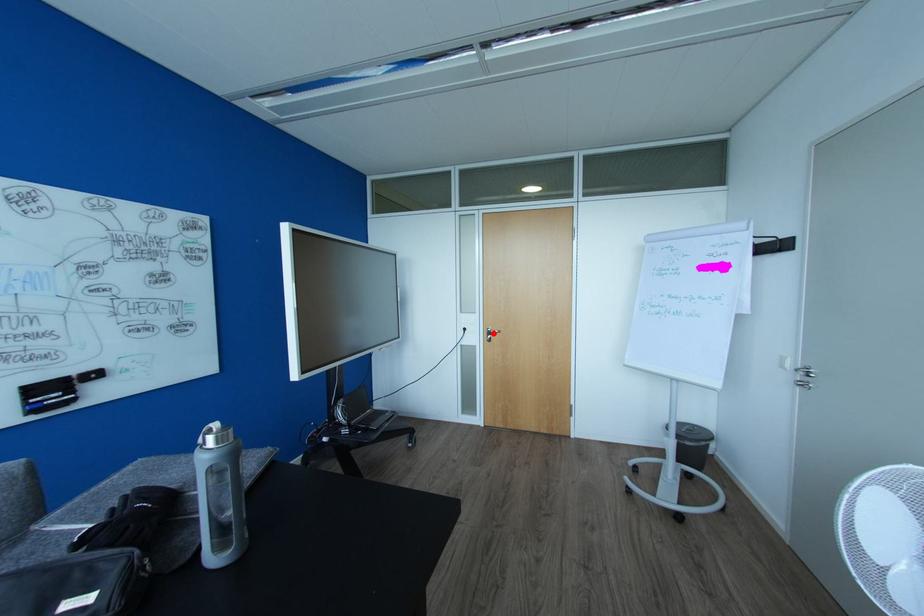
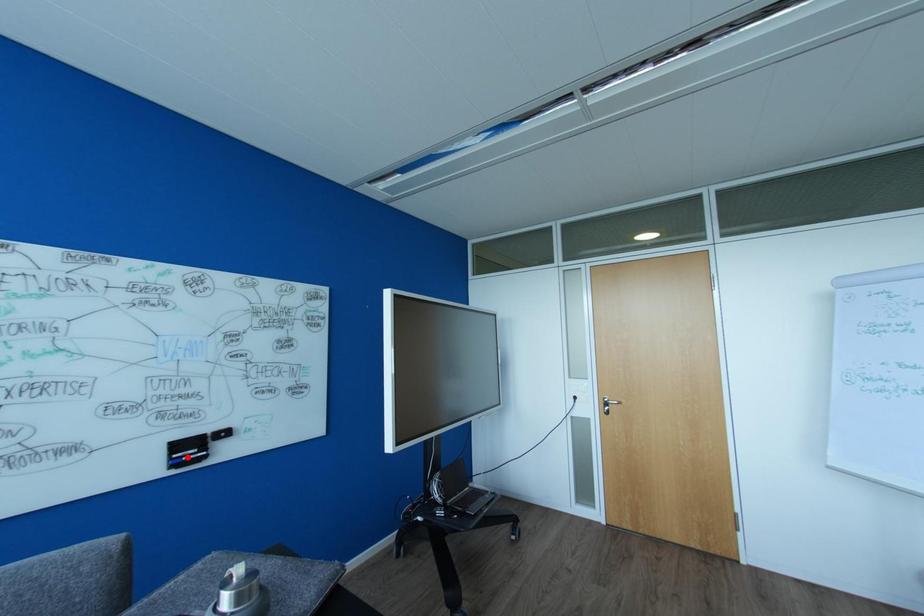
I am providing you with two images of the same scene from different viewpoints. A red point is marked on the first image and another point is marked on the second image. Is the red point in image1 aligned with the point shown in image2?

No